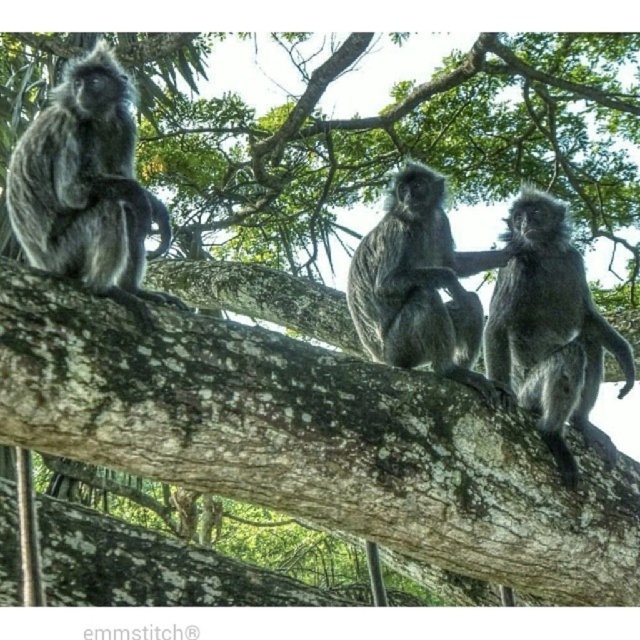
Does silvery fur monkey at left have a lesser width compared to silvery fur monkey at center?

Correct, silvery fur monkey at left's width is less than silvery fur monkey at center's.

What do you see at coordinates (86, 186) in the screenshot? The height and width of the screenshot is (640, 640). I see `silvery fur monkey at left` at bounding box center [86, 186].

Between point (108, 244) and point (451, 272), which one is positioned behind?

The point (451, 272) is more distant.

This screenshot has width=640, height=640. Identify the location of silvery fur monkey at left. (86, 186).

Does silvery fur monkey at right have a lesser width compared to silvery fur monkey at center?

Yes.

Is silvery fur monkey at right smaller than silvery fur monkey at center?

Incorrect, silvery fur monkey at right is not smaller in size than silvery fur monkey at center.

Does point (577, 360) come behind point (445, 269)?

No, it is not.

At what (x,y) coordinates should I click in order to perform the action: click on silvery fur monkey at right. Please return your answer as a coordinate pair (x, y). The height and width of the screenshot is (640, 640). Looking at the image, I should click on (548, 330).

Is silvery fur monkey at left positioned at the back of silvery fur monkey at right?

No, silvery fur monkey at left is closer to the viewer.

Which is above, silvery fur monkey at left or silvery fur monkey at right?

silvery fur monkey at left is higher up.

At what (x,y) coordinates should I click in order to perform the action: click on silvery fur monkey at left. Please return your answer as a coordinate pair (x, y). The width and height of the screenshot is (640, 640). Looking at the image, I should click on (86, 186).